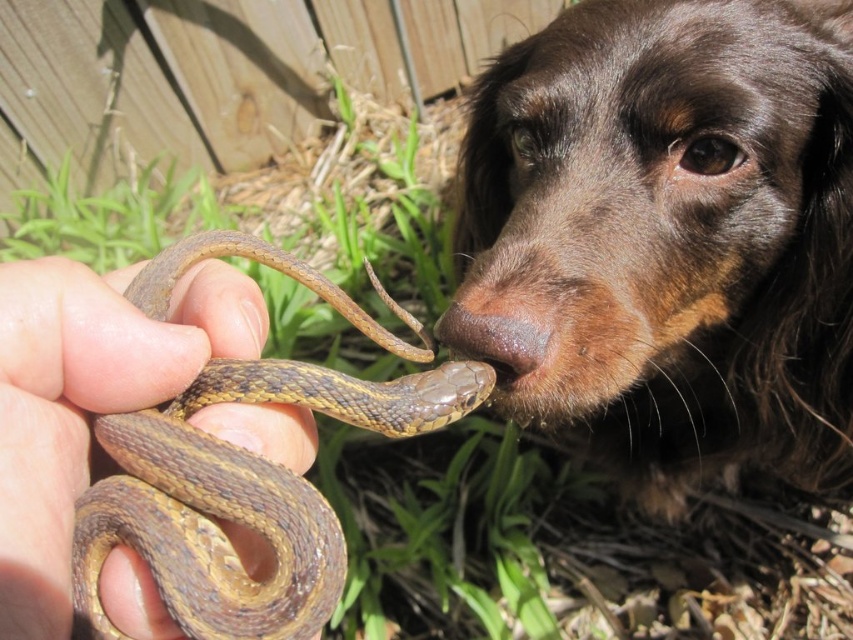
Does brown fur dog at center come behind brown matte nose at center?

Yes, it is behind brown matte nose at center.

Is point (706, 461) closer to viewer compared to point (491, 340)?

No, (706, 461) is behind (491, 340).

Where is `brown fur dog at center`? The width and height of the screenshot is (853, 640). brown fur dog at center is located at coordinates (668, 236).

Is point (347, 376) positioned in front of point (508, 330)?

Yes, it is.

Who is shorter, brown/scaly snake at center or brown matte nose at center?

brown matte nose at center

This screenshot has width=853, height=640. What are the coordinates of `brown/scaly snake at center` in the screenshot? It's located at (242, 497).

Is brown fur dog at center to the left of brown/scaly snake at center from the viewer's perspective?

In fact, brown fur dog at center is to the right of brown/scaly snake at center.

Does point (502, 262) come in front of point (310, 518)?

That is False.

I want to click on brown fur dog at center, so click(x=668, y=236).